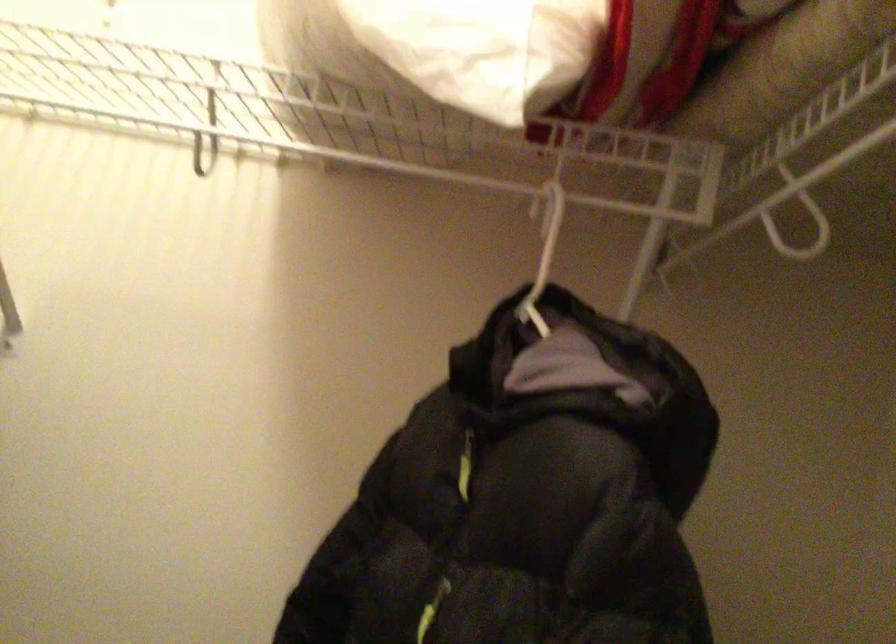
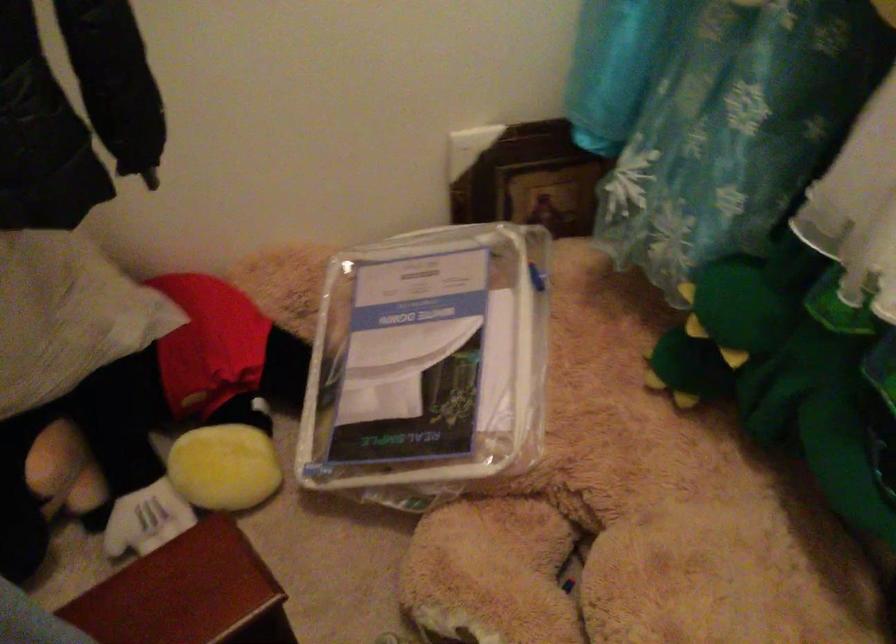
The first image is from the beginning of the video and the second image is from the end. How did the camera likely rotate when shooting the video?

The camera rotated toward right-down.